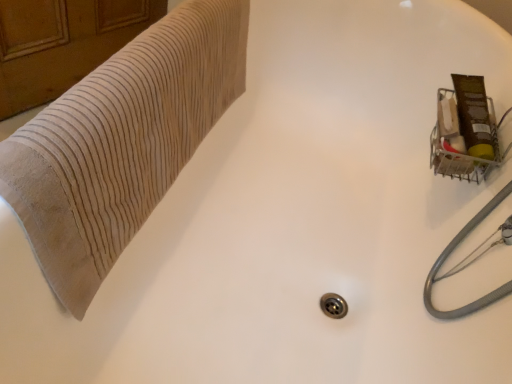
Find the location of a particular element. Image resolution: width=512 pixels, height=384 pixels. free spot above gray textured towel at upper left (from a real-world perspective) is located at coordinates (129, 57).